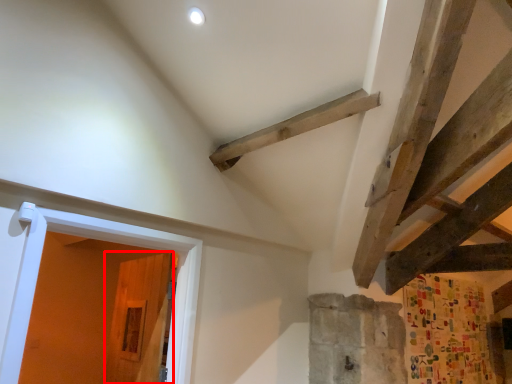
Question: From the image's perspective, where is door (annotated by the red box) located relative to door?

Choices:
 (A) above
 (B) below

Answer: (B)